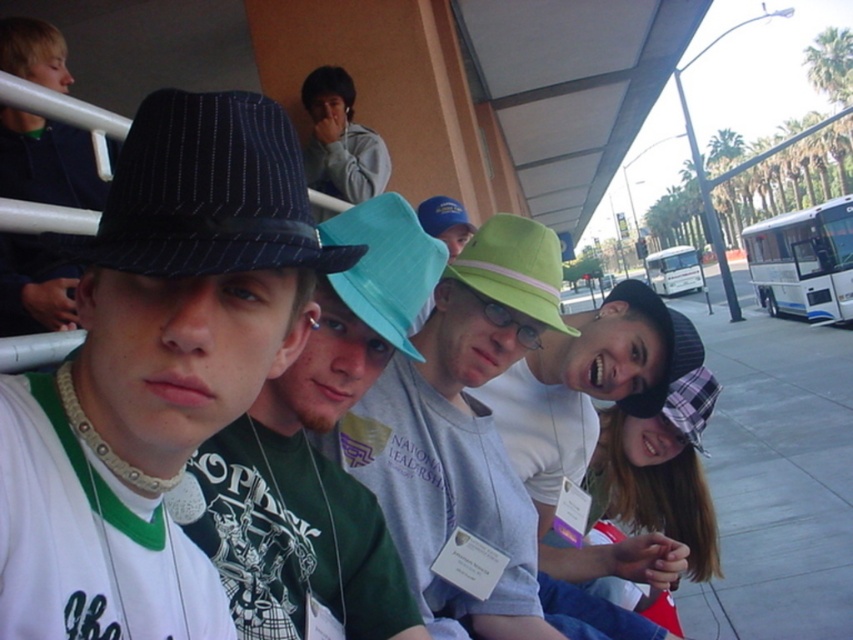
You are a delivery person needing to deliver a package to the plaid fabric hat at center. The white glossy bus at right is blocking the path. Can you walk around the bus to reach the hat?

The distance between the white glossy bus at right and plaid fabric hat at center is 21.56 meters. Since the bus is blocking the path, you would need to go around it, but the distance provided doesn

You are a photographer trying to capture a clear photo of the green fabric hat at center without the white glossy bus at right blocking it. What adjustment should you make to your position?

Move forward to get closer to the green fabric hat at center so that it is no longer blocked by the white glossy bus at right, since the green fabric hat at center is currently behind the white glossy bus at right.